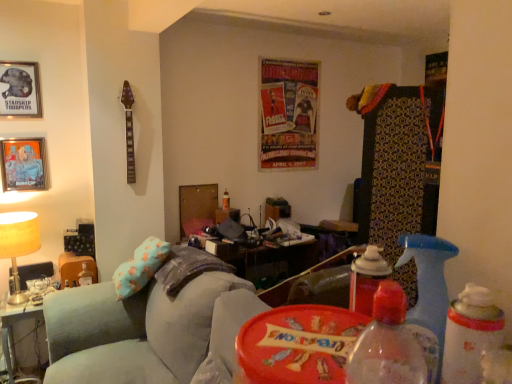
Question: From a real-world perspective, is translucent plastic spray bottle at right, the third bottle from the back, on top of orange matte picture frame at left, acting as the 1th picture frame starting from the bottom?

Choices:
 (A) no
 (B) yes

Answer: (A)

Question: From a real-world perspective, is translucent plastic spray bottle at right, which appears as the first bottle when viewed from the right, under orange matte picture frame at left, arranged as the 2th picture frame when viewed from the top?

Choices:
 (A) no
 (B) yes

Answer: (B)

Question: Considering the relative sizes of translucent plastic spray bottle at right, which is the fourth bottle from left to right, and orange matte picture frame at left, arranged as the 2th picture frame when viewed from the top, in the image provided, is translucent plastic spray bottle at right, which is the fourth bottle from left to right, shorter than orange matte picture frame at left, arranged as the 2th picture frame when viewed from the top,?

Choices:
 (A) no
 (B) yes

Answer: (B)

Question: Does translucent plastic spray bottle at right, which is the fourth bottle from left to right, have a greater width compared to orange matte picture frame at left, acting as the 1th picture frame starting from the bottom?

Choices:
 (A) yes
 (B) no

Answer: (A)

Question: Is translucent plastic spray bottle at right, which is the fourth bottle from left to right, at the left side of orange matte picture frame at left, acting as the 1th picture frame starting from the bottom?

Choices:
 (A) yes
 (B) no

Answer: (B)

Question: Considering the positions of translucent plastic bottle at lower right, the second bottle viewed from the right, and shiny paper poster at center in the image, is translucent plastic bottle at lower right, the second bottle viewed from the right, bigger or smaller than shiny paper poster at center?

Choices:
 (A) small
 (B) big

Answer: (A)

Question: Looking at their shapes, would you say translucent plastic bottle at lower right, which is the fourth bottle in back-to-front order, is wider or thinner than shiny paper poster at center?

Choices:
 (A) thin
 (B) wide

Answer: (B)

Question: In the image, is translucent plastic bottle at lower right, which is the fourth bottle in back-to-front order, positioned in front of or behind shiny paper poster at center?

Choices:
 (A) behind
 (B) front

Answer: (B)

Question: From a real-world perspective, relative to shiny paper poster at center, is translucent plastic bottle at lower right, the first bottle when ordered from front to back, vertically above or below?

Choices:
 (A) above
 (B) below

Answer: (B)

Question: Visually, is translucent plastic bottle at lower right, the second bottle viewed from the right, positioned to the left or to the right of translucent plastic bottle at lower left, placed as the 3th bottle when sorted from front to back?

Choices:
 (A) right
 (B) left

Answer: (A)

Question: Is translucent plastic bottle at lower right, the first bottle when ordered from front to back, bigger or smaller than translucent plastic bottle at lower left, which ranks as the second bottle in back-to-front order?

Choices:
 (A) small
 (B) big

Answer: (A)

Question: Is point (434, 345) positioned closer to the camera than point (93, 274)?

Choices:
 (A) closer
 (B) farther

Answer: (A)

Question: Considering the positions of translucent plastic bottle at lower right, the second bottle viewed from the right, and translucent plastic bottle at lower left, marked as the first bottle in a left-to-right arrangement, in the image, is translucent plastic bottle at lower right, the second bottle viewed from the right, wider or thinner than translucent plastic bottle at lower left, marked as the first bottle in a left-to-right arrangement,?

Choices:
 (A) thin
 (B) wide

Answer: (A)

Question: Would you say velvet teal swivel chair at lower left is inside or outside translucent plastic spray bottle at right, which appears as the first bottle when viewed from the right?

Choices:
 (A) inside
 (B) outside

Answer: (B)

Question: Considering their positions, is velvet teal swivel chair at lower left located in front of or behind translucent plastic spray bottle at right, which appears as the first bottle when viewed from the right?

Choices:
 (A) behind
 (B) front

Answer: (A)